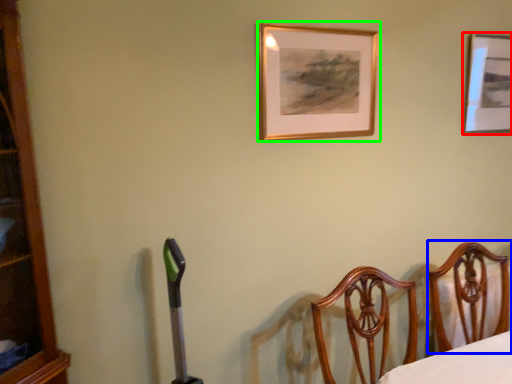
Question: Which object is the closest to the picture frame (highlighted by a red box)? Choose among these: furniture (highlighted by a blue box) or picture frame (highlighted by a green box).

Choices:
 (A) furniture
 (B) picture frame

Answer: (B)